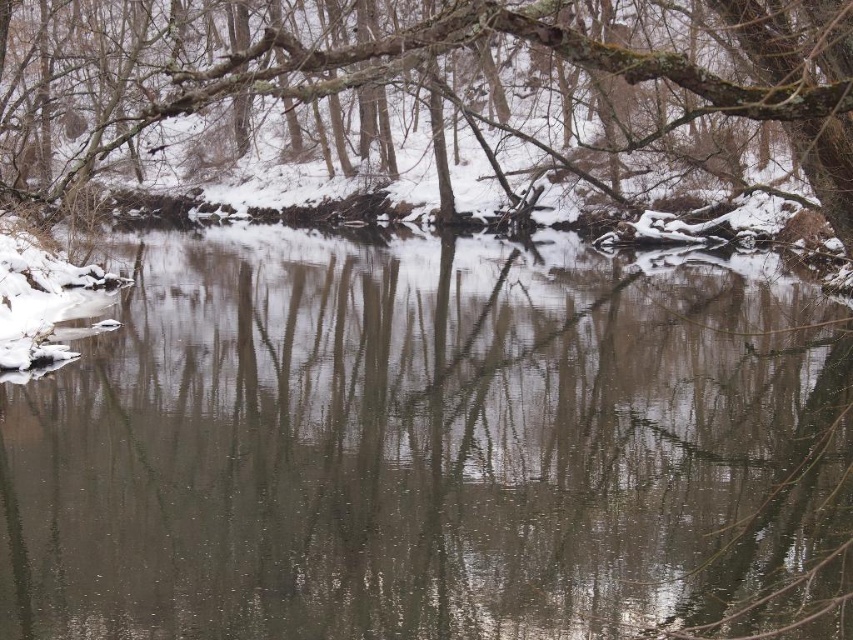
Is clear water at center shorter than smooth bark tree at upper center?

Correct, clear water at center is not as tall as smooth bark tree at upper center.

In the scene shown: Is clear water at center to the right of smooth bark tree at upper center from the viewer's perspective?

Correct, you'll find clear water at center to the right of smooth bark tree at upper center.

Is point (241, 410) less distant than point (102, 118)?

Yes, it is in front of point (102, 118).

The image size is (853, 640). What are the coordinates of `clear water at center` in the screenshot? It's located at (428, 445).